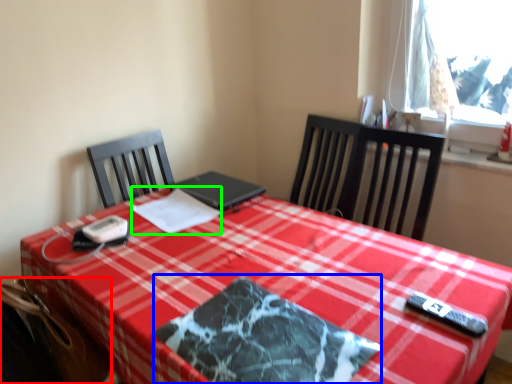
Question: Estimate the real-world distances between objects in this image. Which object is farther from swivel chair (highlighted by a red box), place mat (highlighted by a blue box) or linen (highlighted by a green box)?

Choices:
 (A) place mat
 (B) linen

Answer: (B)